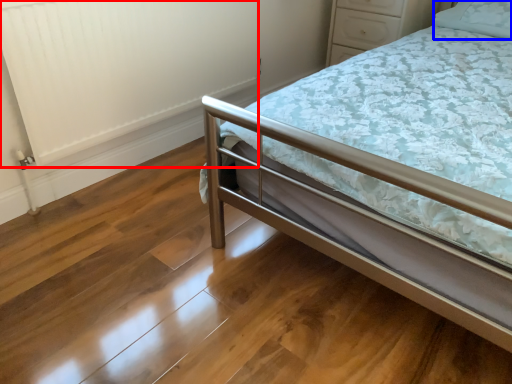
Question: Which object appears closest to the camera in this image, radiator (highlighted by a red box) or pillow (highlighted by a blue box)?

Choices:
 (A) radiator
 (B) pillow

Answer: (A)